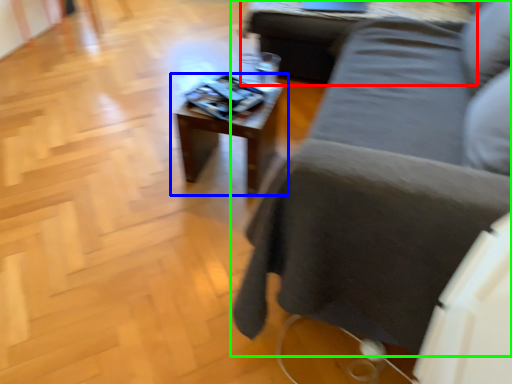
Question: Which object is positioned farthest from table (highlighted by a red box)? Select from table (highlighted by a blue box) and studio couch (highlighted by a green box).

Choices:
 (A) table
 (B) studio couch

Answer: (B)